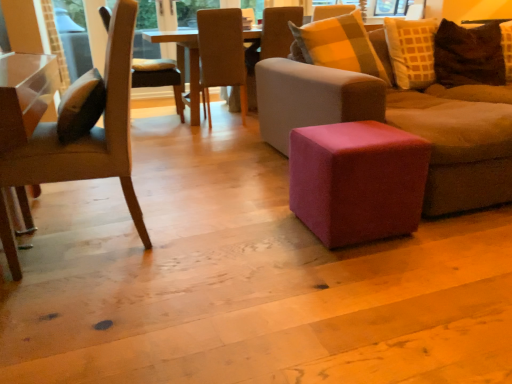
In order to click on empty space that is to the right of matte brown chair at left, which is counted as the 4th chair, starting from the back in this screenshot , I will do `click(206, 235)`.